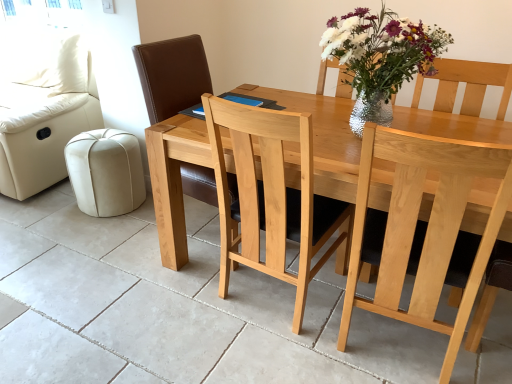
Where is `vacant space that is to the left of light wood chair at center, the 2th chair in the left-to-right sequence`? vacant space that is to the left of light wood chair at center, the 2th chair in the left-to-right sequence is located at coordinates (296, 334).